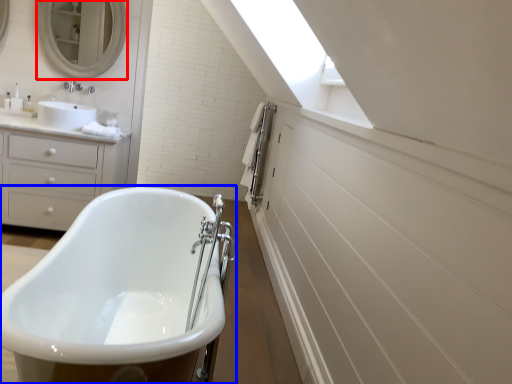
Question: Among these objects, which one is farthest to the camera, mirror (highlighted by a red box) or bathtub (highlighted by a blue box)?

Choices:
 (A) mirror
 (B) bathtub

Answer: (A)